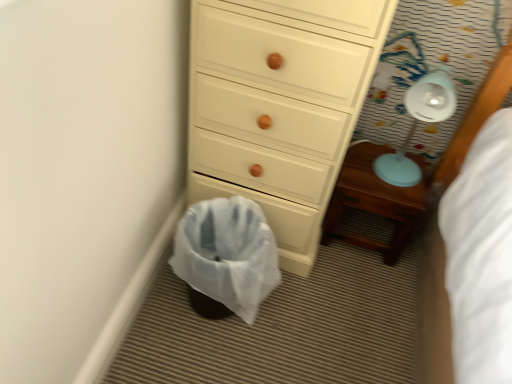
Locate an element on the screen. This screenshot has width=512, height=384. white plastic laundry basket at lower center is located at coordinates (226, 257).

Describe the element at coordinates (417, 124) in the screenshot. I see `white plastic lamp at upper right` at that location.

In order to face white plastic lamp at upper right, should I rotate leftwards or rightwards?

You should look right and rotate roughly 20.418 degrees.

Where is `wooden nightstand at lower right`? The height and width of the screenshot is (384, 512). wooden nightstand at lower right is located at coordinates (373, 202).

Measure the distance between point (377, 201) and camera.

A distance of 1.23 meters exists between point (377, 201) and camera.

The height and width of the screenshot is (384, 512). What do you see at coordinates (279, 105) in the screenshot?
I see `white wood chest of drawers at center` at bounding box center [279, 105].

Where is `white plastic laundry basket at lower center`? white plastic laundry basket at lower center is located at coordinates (226, 257).

Considering the positions of objects white plastic laundry basket at lower center and white plastic lamp at upper right in the image provided, who is behind, white plastic laundry basket at lower center or white plastic lamp at upper right?

white plastic lamp at upper right is more distant.

From the picture: Is white plastic laundry basket at lower center wider than white plastic lamp at upper right?

Indeed, white plastic laundry basket at lower center has a greater width compared to white plastic lamp at upper right.

Which object is positioned more to the right, white plastic lamp at upper right or white wood chest of drawers at center?

Positioned to the right is white plastic lamp at upper right.

Can you confirm if white plastic lamp at upper right is smaller than white wood chest of drawers at center?

Correct, white plastic lamp at upper right occupies less space than white wood chest of drawers at center.

Measure the distance from white plastic lamp at upper right to white wood chest of drawers at center.

white plastic lamp at upper right and white wood chest of drawers at center are 14.84 inches apart.

Between wooden nightstand at lower right and white plastic laundry basket at lower center, which one appears on the right side from the viewer's perspective?

From the viewer's perspective, wooden nightstand at lower right appears more on the right side.

Considering the points (340, 237) and (227, 239), which point is behind, point (340, 237) or point (227, 239)?

The point (340, 237) is farther.

Locate an element on the screen. laundry basket above the wooden nightstand at lower right (from a real-world perspective) is located at coordinates (226, 257).

From the image's perspective, which one is positioned higher, white plastic laundry basket at lower center or white wood chest of drawers at center?

white wood chest of drawers at center, from the image's perspective.

Can you confirm if white plastic laundry basket at lower center is taller than white wood chest of drawers at center?

No, white plastic laundry basket at lower center is not taller than white wood chest of drawers at center.

How different are the orientations of white plastic laundry basket at lower center and white wood chest of drawers at center in degrees?

The facing directions of white plastic laundry basket at lower center and white wood chest of drawers at center are 90 degrees apart.

From a real-world perspective, which object rests below the other?

From a 3D spatial view, white plastic laundry basket at lower center is below.

Which of these two, white wood chest of drawers at center or white plastic laundry basket at lower center, is smaller?

Smaller between the two is white plastic laundry basket at lower center.

Are white wood chest of drawers at center and white plastic laundry basket at lower center far apart?

They are positioned close to each other.

Is white wood chest of drawers at center in front of or behind white plastic lamp at upper right in the image?

Clearly, white wood chest of drawers at center is in front of white plastic lamp at upper right.

Would you say white plastic lamp at upper right is part of white wood chest of drawers at center's contents?

No, white wood chest of drawers at center does not contain white plastic lamp at upper right.

How different are the orientations of white wood chest of drawers at center and white plastic lamp at upper right in degrees?

They differ by 0.036 degrees in their facing directions.

Does white wood chest of drawers at center have a greater height compared to white plastic lamp at upper right?

Indeed, white wood chest of drawers at center has a greater height compared to white plastic lamp at upper right.

Looking at this image, considering the sizes of objects white plastic laundry basket at lower center and wooden nightstand at lower right in the image provided, who is taller, white plastic laundry basket at lower center or wooden nightstand at lower right?

white plastic laundry basket at lower center.

Is white plastic laundry basket at lower center turned away from wooden nightstand at lower right?

white plastic laundry basket at lower center does not have its back to wooden nightstand at lower right.

Does white plastic laundry basket at lower center appear on the left side of wooden nightstand at lower right?

Yes, white plastic laundry basket at lower center is to the left of wooden nightstand at lower right.

Is white plastic laundry basket at lower center next to wooden nightstand at lower right and touching it?

No, white plastic laundry basket at lower center is not making contact with wooden nightstand at lower right.

You are a GUI agent. You are given a task and a screenshot of the screen. Output one action in this format:
    pyautogui.click(x=<x>, y=<y>)
    Task: Click on the lamp above the white plastic laundry basket at lower center (from a real-world perspective)
    The image size is (512, 384).
    Given the screenshot: What is the action you would take?
    pyautogui.click(x=417, y=124)

Locate an element on the screen. This screenshot has height=384, width=512. chest of drawers on the left of white plastic lamp at upper right is located at coordinates (279, 105).

Looking at the image, which one is located further to white wood chest of drawers at center, white plastic laundry basket at lower center or wooden nightstand at lower right?

The object further to white wood chest of drawers at center is wooden nightstand at lower right.

When comparing their distances from white plastic laundry basket at lower center, does white plastic lamp at upper right or wooden nightstand at lower right seem closer?

Based on the image, wooden nightstand at lower right appears to be nearer to white plastic laundry basket at lower center.

From the image, which object appears to be nearer to white wood chest of drawers at center, wooden nightstand at lower right or white plastic lamp at upper right?

Among the two, wooden nightstand at lower right is located nearer to white wood chest of drawers at center.

Based on their spatial positions, is white plastic lamp at upper right or white wood chest of drawers at center closer to white plastic laundry basket at lower center?

white wood chest of drawers at center is closer to white plastic laundry basket at lower center.

When comparing their distances from white wood chest of drawers at center, does white plastic laundry basket at lower center or white plastic lamp at upper right seem further?

white plastic lamp at upper right.

Based on the photo, from the image, which object appears to be nearer to white wood chest of drawers at center, white plastic lamp at upper right or wooden nightstand at lower right?

wooden nightstand at lower right is closer to white wood chest of drawers at center.

From the image, which object appears to be farther from wooden nightstand at lower right, white plastic laundry basket at lower center or white plastic lamp at upper right?

Based on the image, white plastic laundry basket at lower center appears to be further to wooden nightstand at lower right.

When comparing their distances from white plastic lamp at upper right, does wooden nightstand at lower right or white plastic laundry basket at lower center seem further?

Based on the image, white plastic laundry basket at lower center appears to be further to white plastic lamp at upper right.

I want to click on chest of drawers between white plastic laundry basket at lower center and white plastic lamp at upper right from left to right, so click(279, 105).

The width and height of the screenshot is (512, 384). In order to click on nightstand between white plastic laundry basket at lower center and white plastic lamp at upper right in the horizontal direction in this screenshot , I will do tap(373, 202).

Image resolution: width=512 pixels, height=384 pixels. Identify the location of lamp positioned between white wood chest of drawers at center and wooden nightstand at lower right from near to far. (417, 124).

Find the location of a particular element. This screenshot has width=512, height=384. laundry basket positioned between white wood chest of drawers at center and wooden nightstand at lower right from near to far is located at coordinates (226, 257).